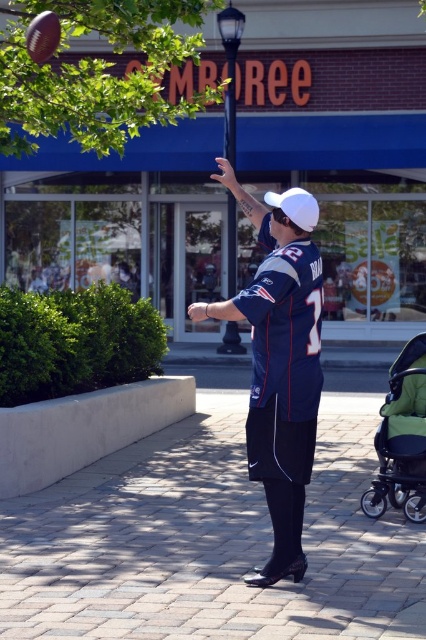
You are standing at point (284,381) in the image. What object is located exactly at your current position?

The blue jersey at center is located exactly at point (284,381).

You are a photographer trying to capture the person in the scene. The blue jersey at center and white matte baseball cap at center are both important for the shot. Which object should you focus on first if you want to ensure both are in frame?

The blue jersey at center is positioned under the white matte baseball cap at center, so focusing on the white matte baseball cap at center first would allow you to frame both objects since the jersey is below it.

What are the coordinates of the blue jersey at center in the image?

The blue jersey at center is located at point coordinates (284,381).